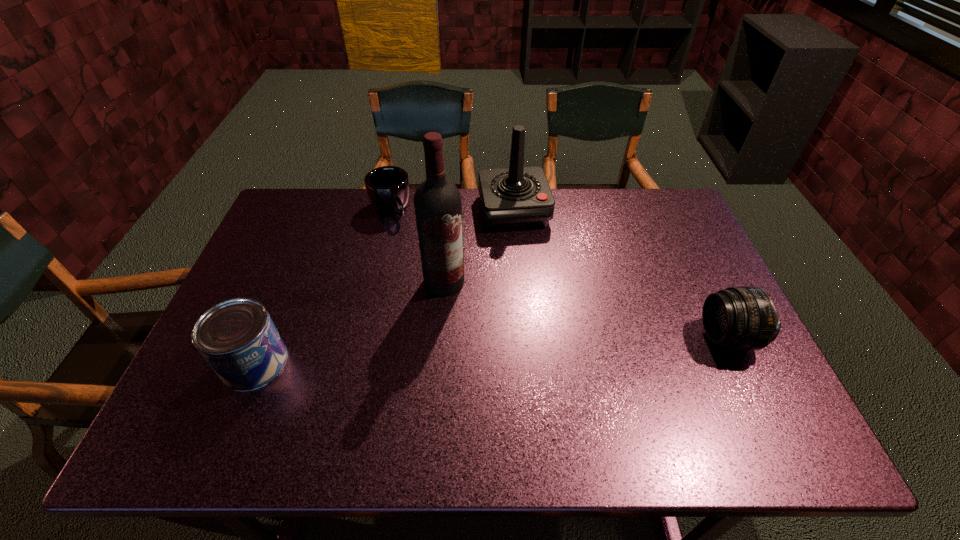
At what (x,y) coordinates should I click in order to perform the action: click on the leftmost object. Please return your answer as a coordinate pair (x, y). The height and width of the screenshot is (540, 960). Looking at the image, I should click on (237, 337).

Find the location of a particular element. the rightmost object is located at coordinates (744, 317).

At what (x,y) coordinates should I click in order to perform the action: click on the tallest object. Please return your answer as a coordinate pair (x, y). The height and width of the screenshot is (540, 960). Looking at the image, I should click on (437, 201).

Identify the location of the third farthest object. The image size is (960, 540). (437, 201).

This screenshot has height=540, width=960. Identify the location of the shortest object. (388, 188).

The height and width of the screenshot is (540, 960). Find the location of `mug`. mug is located at coordinates (388, 188).

Where is `the second object from right to left`? Image resolution: width=960 pixels, height=540 pixels. the second object from right to left is located at coordinates (516, 197).

Locate an element on the screen. the second tallest object is located at coordinates (516, 197).

You are a GUI agent. You are given a task and a screenshot of the screen. Output one action in this format:
    pyautogui.click(x=<x>, y=<y>)
    Task: Click on the vacant area situated 0.120m at the front element of the telephoto lens
    The image size is (960, 540).
    Given the screenshot: What is the action you would take?
    pyautogui.click(x=656, y=337)

This screenshot has width=960, height=540. Identify the location of vacant space situated 0.240m at the front element of the telephoto lens. (608, 337).